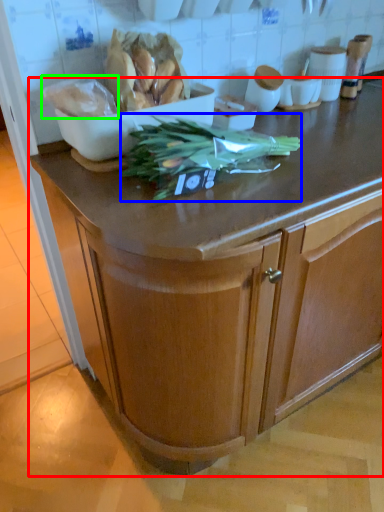
Question: Estimate the real-world distances between objects in this image. Which object is farther from cabinetry (highlighted by a red box), vegetable (highlighted by a blue box) or food (highlighted by a green box)?

Choices:
 (A) vegetable
 (B) food

Answer: (B)